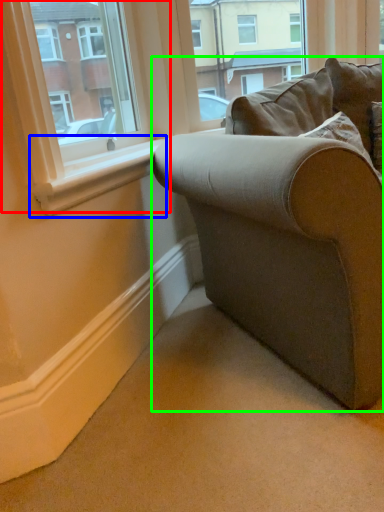
Question: Which object is the closest to the window (highlighted by a red box)? Choose among these: window sill (highlighted by a blue box) or studio couch (highlighted by a green box).

Choices:
 (A) window sill
 (B) studio couch

Answer: (A)